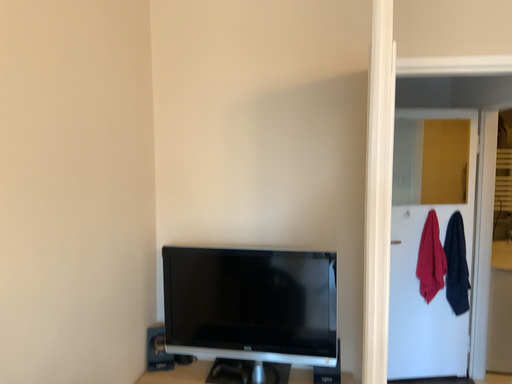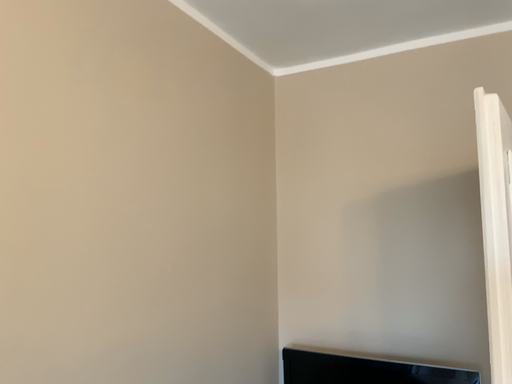
Question: How did the camera likely rotate when shooting the video?

Choices:
 (A) rotated downward
 (B) rotated upward

Answer: (B)